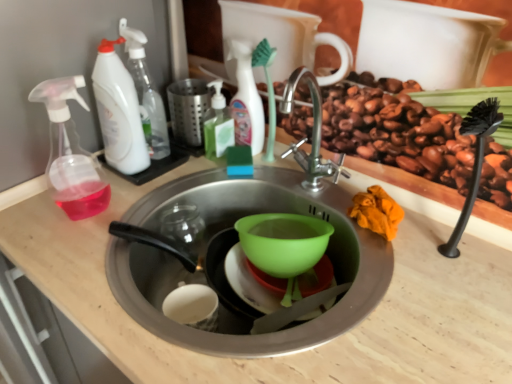
Question: Relative to green liquid soap at upper center, positioned as the second cleaning product in right-to-left order, is light wood counter top at center in front or behind?

Choices:
 (A) behind
 (B) front

Answer: (B)

Question: In terms of height, does light wood counter top at center look taller or shorter compared to green liquid soap at upper center, acting as the 3th cleaning product starting from the left?

Choices:
 (A) tall
 (B) short

Answer: (A)

Question: Based on their relative distances, which object is farther from the transparent plastic spray bottle at left?

Choices:
 (A) green liquid soap at upper center, acting as the 3th cleaning product starting from the left
 (B) white matte bottle at upper center, arranged as the fourth cleaning product when viewed from the left
 (C) light wood counter top at center
 (D) white plastic spray bottle at upper left, the second cleaning product positioned from the left
 (E) white plastic spray bottle at upper left, the 1th cleaning product viewed from the left

Answer: (B)

Question: Estimate the real-world distances between objects in this image. Which object is farther from the light wood counter top at center?

Choices:
 (A) white plastic spray bottle at upper left, which appears as the 4th cleaning product when viewed from the right
 (B) transparent plastic spray bottle at left
 (C) white plastic spray bottle at upper left, the second cleaning product positioned from the left
 (D) white matte bottle at upper center, arranged as the fourth cleaning product when viewed from the left
 (E) green liquid soap at upper center, acting as the 3th cleaning product starting from the left

Answer: (C)